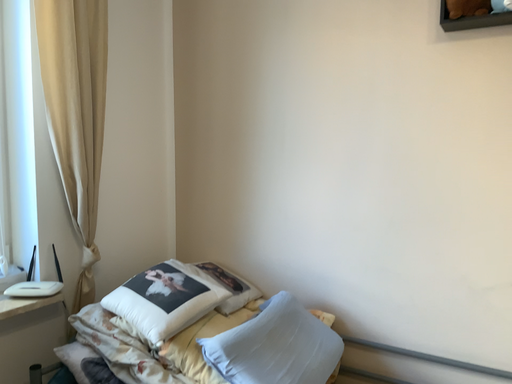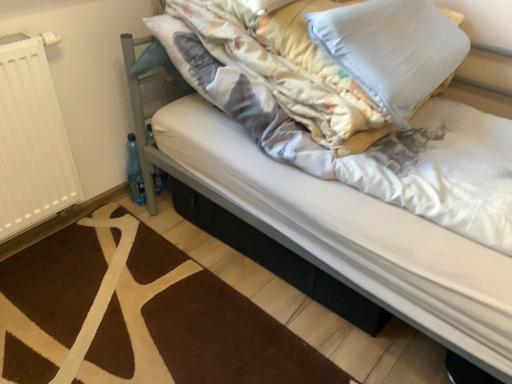
Question: How did the camera likely rotate when shooting the video?

Choices:
 (A) rotated left
 (B) rotated right

Answer: (A)